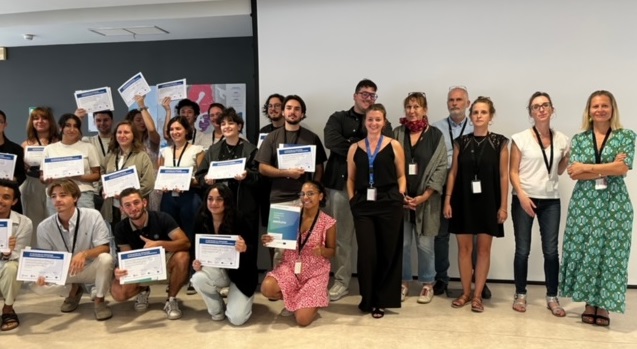
The width and height of the screenshot is (637, 349). What are the coordinates of `floor shadow` in the screenshot? It's located at (24, 318), (88, 308), (125, 313), (155, 302), (197, 312), (262, 314), (287, 318).